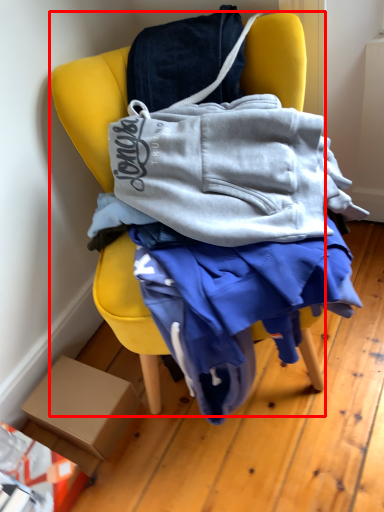
Question: From the image's perspective, where is chair (annotated by the red box) located in relation to box in the image?

Choices:
 (A) above
 (B) below

Answer: (A)